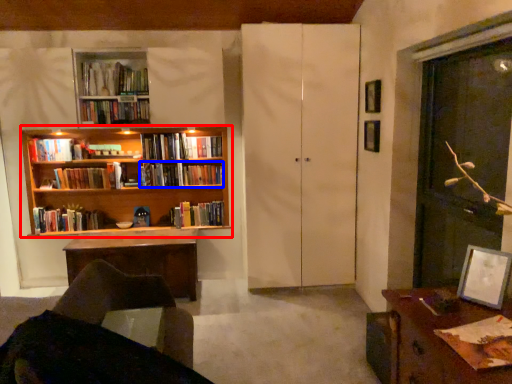
Question: Which object is closer to the camera taking this photo, bookcase (highlighted by a red box) or book (highlighted by a blue box)?

Choices:
 (A) bookcase
 (B) book

Answer: (A)